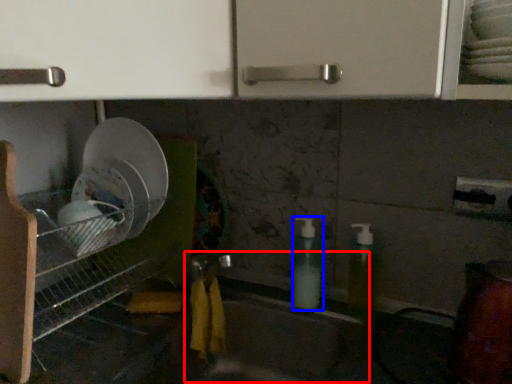
Question: Which object is further to the camera taking this photo, sink (highlighted by a red box) or soap dispenser (highlighted by a blue box)?

Choices:
 (A) sink
 (B) soap dispenser

Answer: (B)